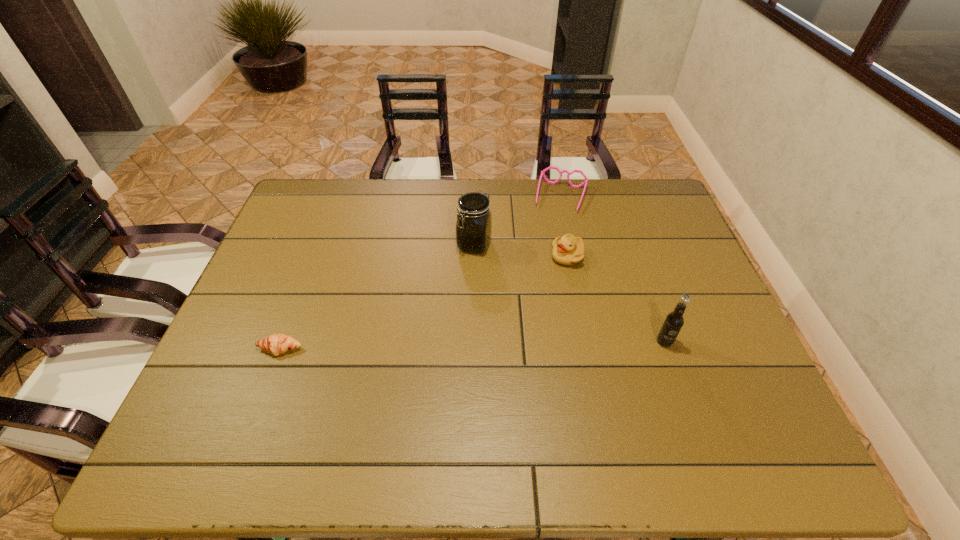
This screenshot has width=960, height=540. I want to click on free space between the shortest object and the spectacles, so click(x=420, y=273).

I want to click on unoccupied position between the duckling and the leftmost object, so click(x=423, y=303).

Identify the location of empty location between the jar and the shortest object. The image size is (960, 540). (377, 297).

This screenshot has height=540, width=960. I want to click on free space between the shortest object and the farthest object, so click(x=420, y=273).

Where is `free space between the rightmost object and the third tallest object`? free space between the rightmost object and the third tallest object is located at coordinates click(616, 299).

Select which object is the second closest to the farthest object. Please provide its 2D coordinates. Your answer should be formatted as a tuple, i.e. [(x, y)], where the tuple contains the x and y coordinates of a point satisfying the conditions above.

[(474, 219)]

Find the location of a particular element. object identified as the second closest to the pastry is located at coordinates (568, 250).